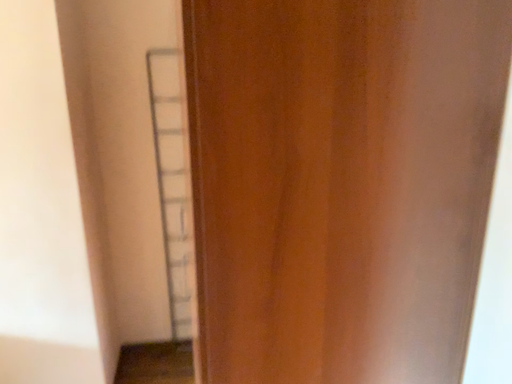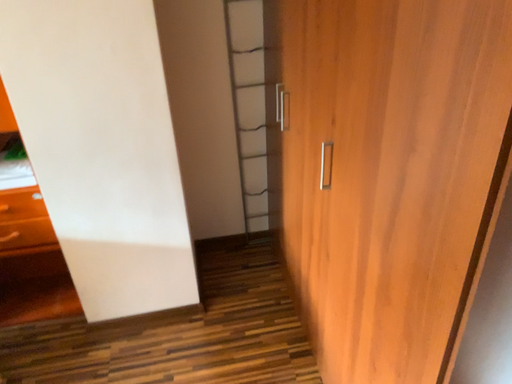
Question: How did the camera likely rotate when shooting the video?

Choices:
 (A) rotated downward
 (B) rotated upward

Answer: (A)